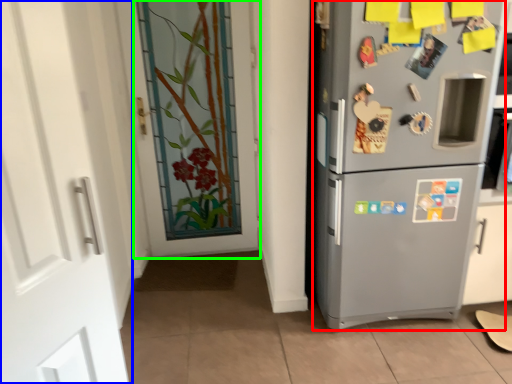
Question: Considering the real-world distances, which object is farthest from refrigerator (highlighted by a red box)? door (highlighted by a blue box) or door (highlighted by a green box)?

Choices:
 (A) door
 (B) door

Answer: (A)